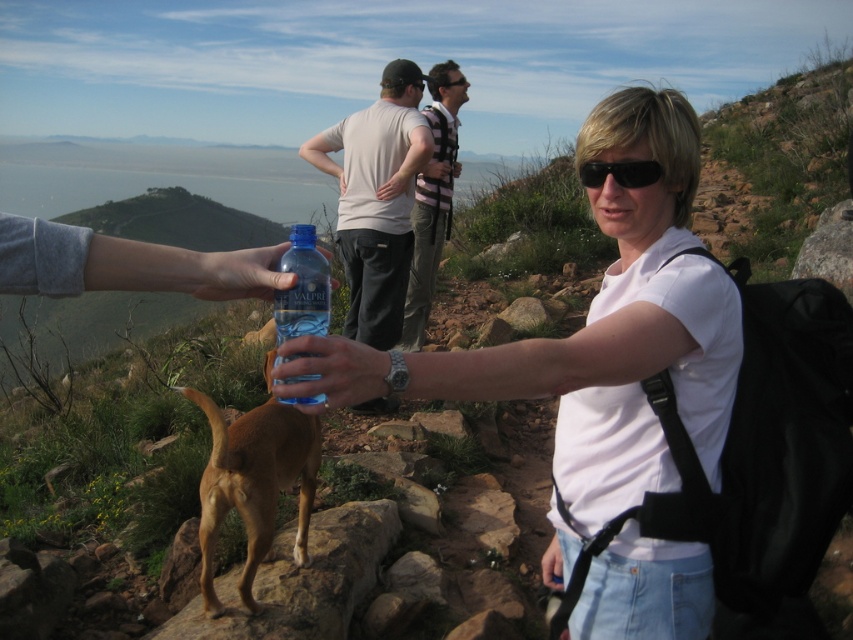
Between point (448, 120) and point (466, 83), which one is positioned behind?

Point (466, 83)

Does striped shirt at center appear on the left side of black plastic sunglasses at upper center?

Correct, you'll find striped shirt at center to the left of black plastic sunglasses at upper center.

Is point (407, 324) positioned after point (456, 84)?

That is False.

Locate an element on the screen. Image resolution: width=853 pixels, height=640 pixels. striped shirt at center is located at coordinates (432, 202).

Which is behind, point (248, 531) or point (422, 193)?

The point (422, 193) is behind.

Measure the distance between brown furry dog at lower left and camera.

brown furry dog at lower left is 2.23 meters from camera.

This screenshot has height=640, width=853. What are the coordinates of `brown furry dog at lower left` in the screenshot? It's located at (254, 481).

Can you confirm if white matte shirt at center is taller than blue plastic bottle at center?

Correct, white matte shirt at center is much taller as blue plastic bottle at center.

Between white matte shirt at center and blue plastic bottle at center, which one has less height?

blue plastic bottle at center is shorter.

Locate an element on the screen. This screenshot has height=640, width=853. white matte shirt at center is located at coordinates (595, 337).